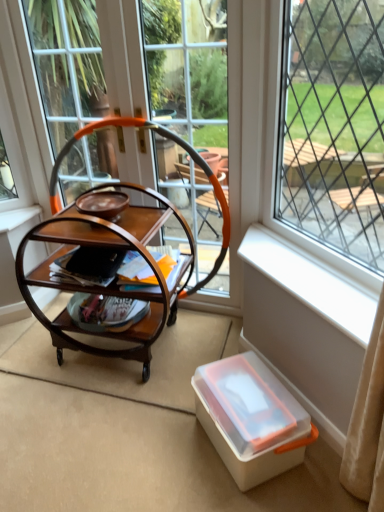
Locate an element on the screen. The width and height of the screenshot is (384, 512). blank space above white plastic window sill at lower right (from a real-world perspective) is located at coordinates (302, 265).